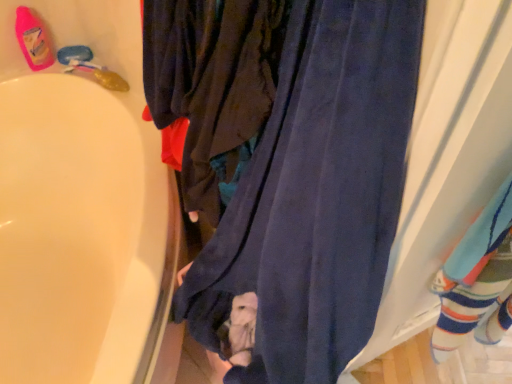
Question: Is pink plastic bottle at upper left oriented towards navy blue fabric at center?

Choices:
 (A) yes
 (B) no

Answer: (A)

Question: From a real-world perspective, does pink plastic bottle at upper left sit lower than navy blue fabric at center?

Choices:
 (A) yes
 (B) no

Answer: (A)

Question: Can you confirm if pink plastic bottle at upper left is positioned to the right of navy blue fabric at center?

Choices:
 (A) no
 (B) yes

Answer: (A)

Question: Is pink plastic bottle at upper left shorter than navy blue fabric at center?

Choices:
 (A) yes
 (B) no

Answer: (A)

Question: Is pink plastic bottle at upper left positioned behind navy blue fabric at center?

Choices:
 (A) yes
 (B) no

Answer: (A)

Question: Which is correct: pink plastic bottle at upper left is inside striped cotton socks at right, or outside of it?

Choices:
 (A) outside
 (B) inside

Answer: (A)

Question: Considering the positions of pink plastic bottle at upper left and striped cotton socks at right in the image, is pink plastic bottle at upper left wider or thinner than striped cotton socks at right?

Choices:
 (A) wide
 (B) thin

Answer: (B)

Question: Considering their positions, is pink plastic bottle at upper left located in front of or behind striped cotton socks at right?

Choices:
 (A) front
 (B) behind

Answer: (B)

Question: Is point (33, 31) closer or farther from the camera than point (463, 321)?

Choices:
 (A) closer
 (B) farther

Answer: (B)

Question: Looking at the image, does striped cotton socks at right seem bigger or smaller compared to navy blue fabric at center?

Choices:
 (A) small
 (B) big

Answer: (A)

Question: Considering the positions of point (440, 347) and point (387, 74), is point (440, 347) closer or farther from the camera than point (387, 74)?

Choices:
 (A) closer
 (B) farther

Answer: (B)

Question: Is striped cotton socks at right in front of or behind navy blue fabric at center in the image?

Choices:
 (A) behind
 (B) front

Answer: (A)

Question: Looking at their shapes, would you say striped cotton socks at right is wider or thinner than navy blue fabric at center?

Choices:
 (A) thin
 (B) wide

Answer: (A)

Question: From the image's perspective, relative to navy blue fabric at center, is pink plastic bottle at upper left above or below?

Choices:
 (A) below
 (B) above

Answer: (B)

Question: Visually, is pink plastic bottle at upper left positioned to the left or to the right of navy blue fabric at center?

Choices:
 (A) left
 (B) right

Answer: (A)